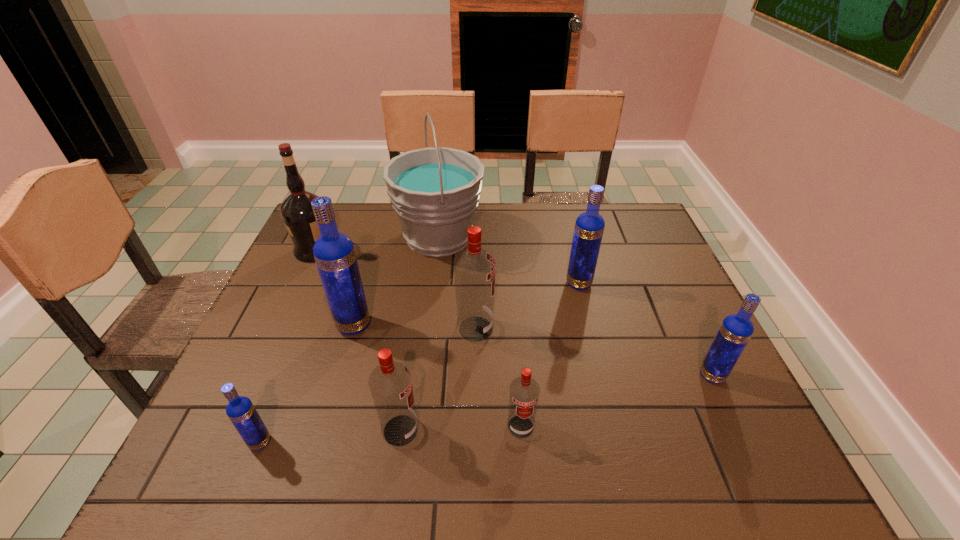
The height and width of the screenshot is (540, 960). Find the location of `object at the near left corner`. object at the near left corner is located at coordinates (240, 410).

In the image, there is a desktop. Identify the location of vacant region at the far edge. (566, 224).

At what (x,y) coordinates should I click in order to perform the action: click on vacant space at the left edge of the desktop. Please return your answer as a coordinate pair (x, y). Image resolution: width=960 pixels, height=540 pixels. Looking at the image, I should click on (257, 321).

The image size is (960, 540). Find the location of `vacant region at the right edge of the desktop`. vacant region at the right edge of the desktop is located at coordinates (655, 337).

Where is `free location at the near left corner of the desktop`? The image size is (960, 540). free location at the near left corner of the desktop is located at coordinates (217, 467).

Find the location of `vacant area at the near right corner of the desktop`. vacant area at the near right corner of the desktop is located at coordinates (757, 447).

This screenshot has width=960, height=540. I want to click on free space between the leftmost red vodka and the liquor, so click(358, 340).

At what (x,y) coordinates should I click in order to perform the action: click on free space between the liquor and the blue bucket. Please return your answer as a coordinate pair (x, y). Looking at the image, I should click on (377, 244).

At what (x,y) coordinates should I click in order to perform the action: click on vacant area that lies between the farthest red vodka and the rightmost blue vodka. Please return your answer as a coordinate pair (x, y). The height and width of the screenshot is (540, 960). Looking at the image, I should click on (593, 352).

Find the location of a particular element. unoccupied position between the farthest blue vodka and the liquor is located at coordinates (447, 267).